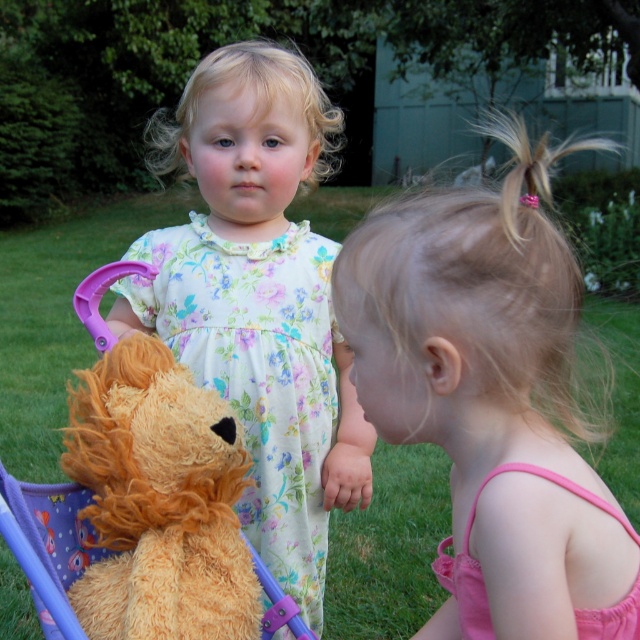
Based on the photo, who is positioned more to the left, fluffy white dress at center or fuzzy orange teddy bear at left?

From the viewer's perspective, fuzzy orange teddy bear at left appears more on the left side.

Is fluffy white dress at center wider than fuzzy orange teddy bear at left?

Yes.

Locate an element on the screen. fluffy white dress at center is located at coordinates (259, 300).

You are a GUI agent. You are given a task and a screenshot of the screen. Output one action in this format:
    pyautogui.click(x=<x>, y=<y>)
    Task: Click on the fluffy white dress at center
    The height and width of the screenshot is (640, 640).
    Given the screenshot: What is the action you would take?
    pyautogui.click(x=259, y=300)

Who is positioned more to the right, pink fabric dress at center or fluffy white dress at center?

pink fabric dress at center is more to the right.

Which is behind, point (480, 580) or point (307, 248)?

Positioned behind is point (307, 248).

The height and width of the screenshot is (640, 640). I want to click on pink fabric dress at center, so click(x=492, y=397).

Is point (396, 390) positioned after point (444, 557)?

No, (396, 390) is closer to viewer.

Who is lower down, pink fabric dress at center or pink satin dress at lower right?

pink satin dress at lower right is below.

Between point (552, 289) and point (577, 492), which one is positioned behind?

The point (577, 492) is behind.

Identify the location of pink fabric dress at center. (492, 397).